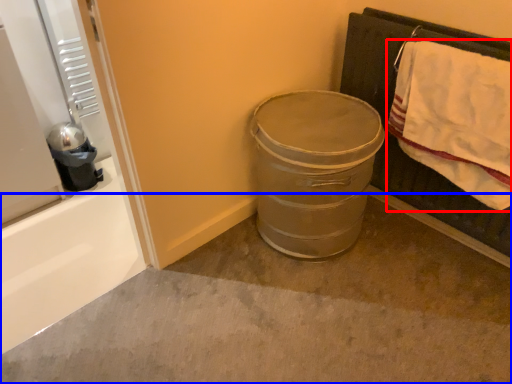
Question: Which object appears closest to the camera in this image, bath towel (highlighted by a red box) or concrete (highlighted by a blue box)?

Choices:
 (A) bath towel
 (B) concrete

Answer: (B)